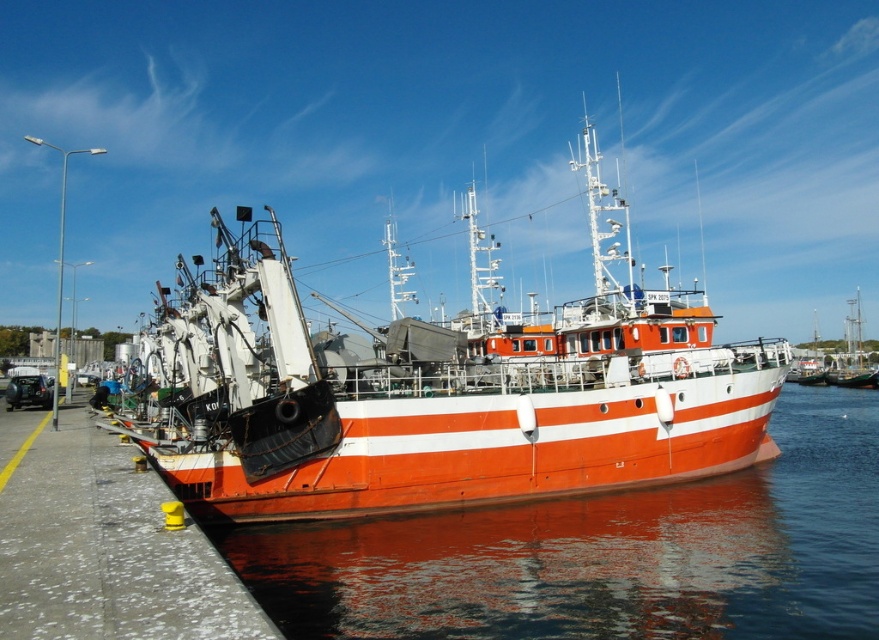
Consider the image. You are a marine biologist preparing to board the orange matte boat at center for a research expedition. You are currently standing on the pier 15 meters away from the boat. Can you safely walk directly to the boat without needing assistance?

The orange matte boat at center is 21.10 meters away from the camera. Since you are 15 meters away from the boat, you are still 6.1 meters away and would require assistance to reach it.

In the scene shown: You are standing on the pier looking at the fishing vessel. There are two points marked on the boat. One is at coordinate point (418, 470) and the other is at point (685, 545). Which point is closer to you?

Point (418, 470) is closer to you because it is further to the camera than point (685, 545).